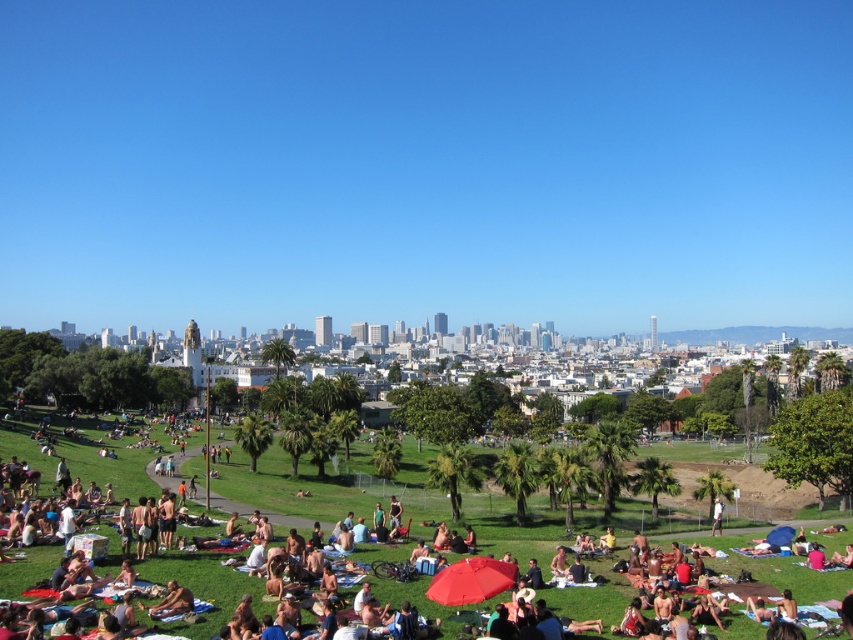
You are planning to set up a picnic in the park and have a picnic blanket that is 1.5 meters wide. You see the matte black tent at center and the tan skin person at lower left in the park. Which object is wider than the picnic blanket?

The matte black tent at center is wider than the tan skin person at lower left, so the matte black tent at center is wider than the picnic blanket.

You are a visitor at the park and want to take a photo of the matte black tent at center without the tan skin person at lower left blocking the view. Based on their positions, is this possible?

The matte black tent at center is located above the tan skin person at lower left, so it is possible to take a photo of the matte black tent at center without the tan skin person at lower left blocking the view by positioning yourself to capture the tent from a higher angle or moving to a spot where the person is not in the frame.